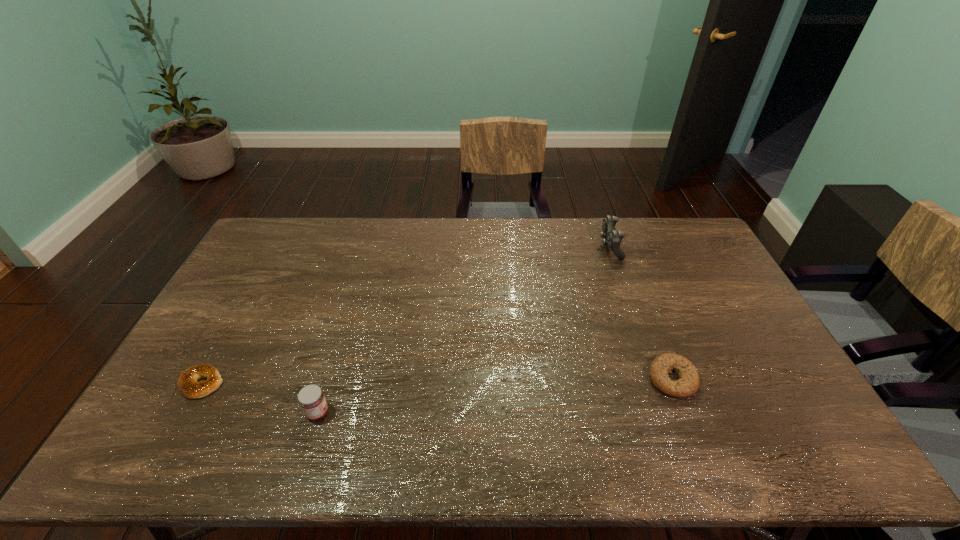
Find the location of `free space located 0.290m on the surface of the farthest object with buttons`. free space located 0.290m on the surface of the farthest object with buttons is located at coordinates (521, 247).

Locate an element on the screen. vacant space located on the back of the third shortest object is located at coordinates (337, 348).

The width and height of the screenshot is (960, 540). Find the location of `vacant region located on the right of the taller bagel`. vacant region located on the right of the taller bagel is located at coordinates (769, 379).

At what (x,y) coordinates should I click in order to perform the action: click on free space located 0.250m on the back of the left bagel. Please return your answer as a coordinate pair (x, y). This screenshot has height=540, width=960. Looking at the image, I should click on (246, 303).

Find the location of a particular element. The width and height of the screenshot is (960, 540). object that is at the far edge is located at coordinates (613, 238).

Identify the location of object that is at the left edge. This screenshot has height=540, width=960. (187, 384).

Locate an element on the screen. vacant region at the far edge is located at coordinates (455, 238).

Where is `vacant space at the near edge of the desktop`? The image size is (960, 540). vacant space at the near edge of the desktop is located at coordinates (696, 441).

The height and width of the screenshot is (540, 960). In order to click on free space at the left edge in this screenshot , I will do `click(242, 272)`.

Identify the location of vacant space at the right edge of the desktop. Image resolution: width=960 pixels, height=540 pixels. (753, 359).